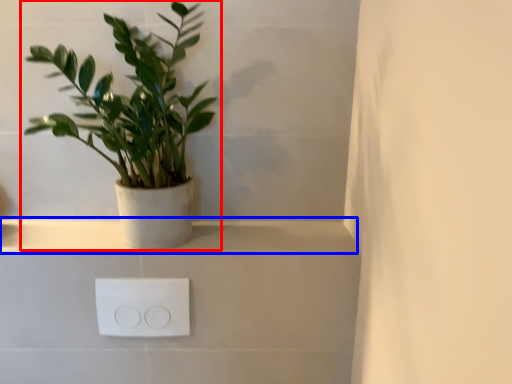
Question: Which object appears farthest to the camera in this image, houseplant (highlighted by a red box) or window sill (highlighted by a blue box)?

Choices:
 (A) houseplant
 (B) window sill

Answer: (B)